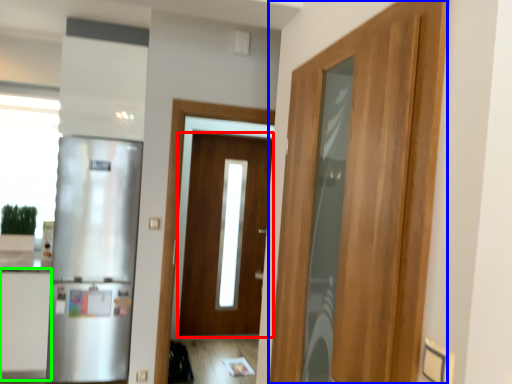
Question: Based on their relative distances, which object is farther from door (highlighted by a red box)? Choose from door (highlighted by a blue box) and cabinetry (highlighted by a green box).

Choices:
 (A) door
 (B) cabinetry

Answer: (A)